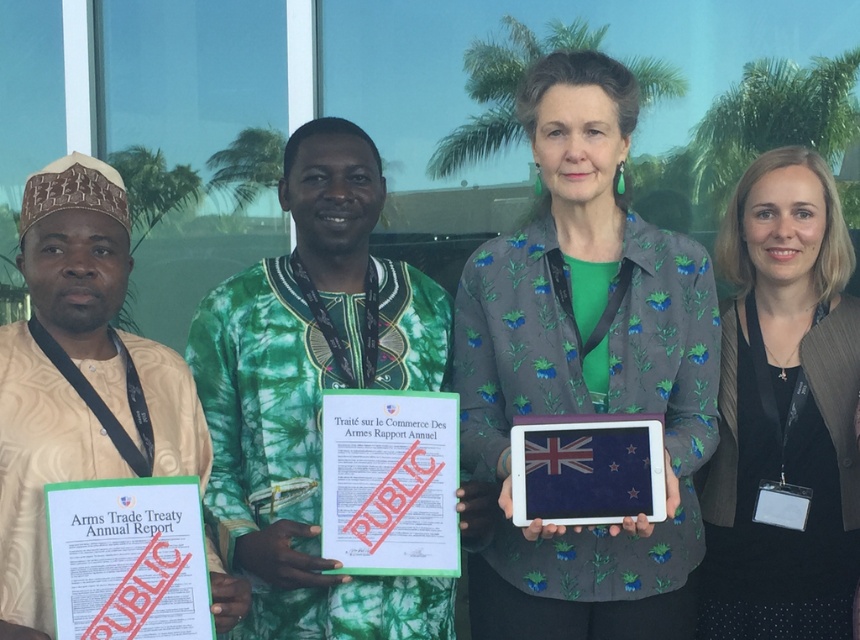
You are a security officer at the event and need to verify the documents. Which document is positioned lower between the green paper document at lower left and the blue fabric tablet at center?

The green paper document at lower left is located below the blue fabric tablet at center, so it is positioned lower.